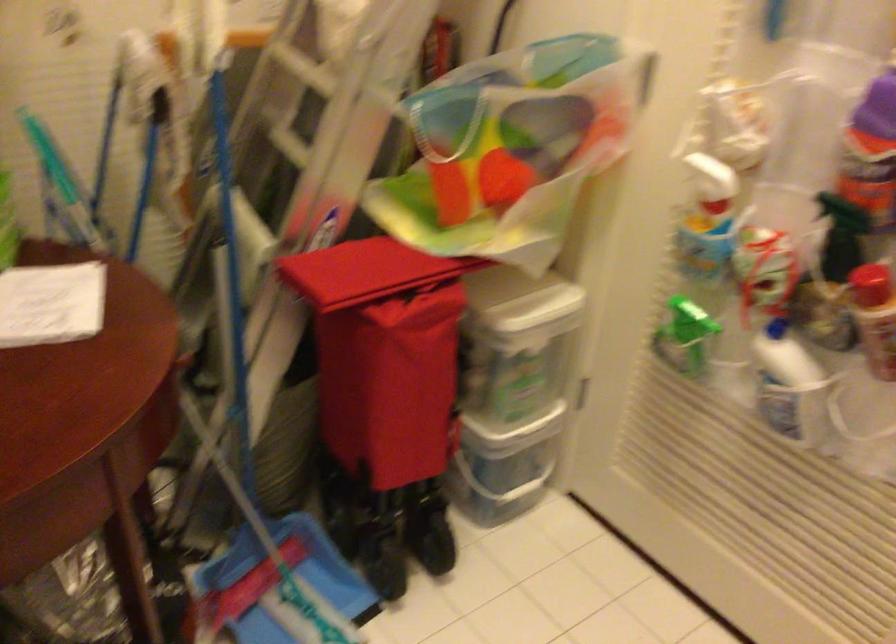
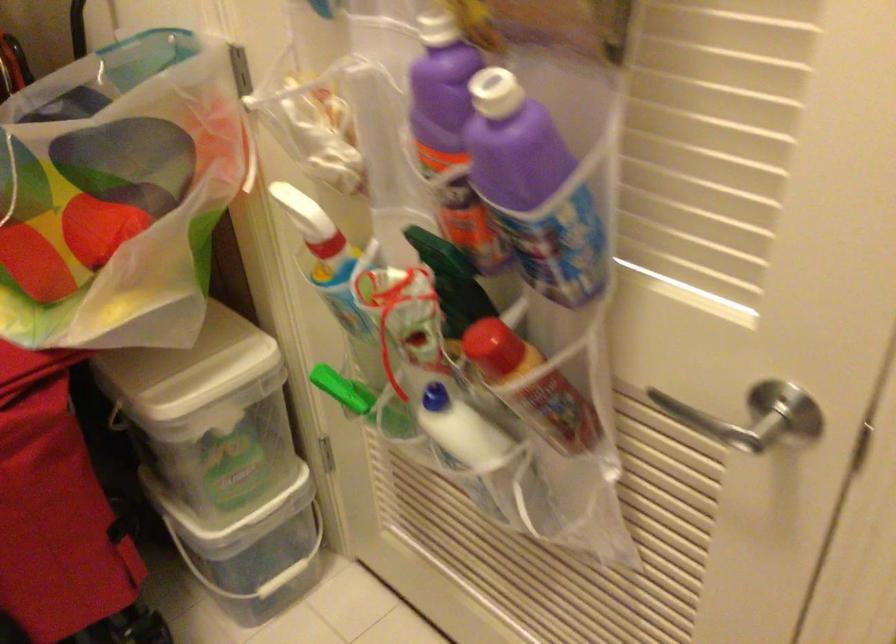
Question: The first image is from the beginning of the video and the second image is from the end. How did the camera likely rotate when shooting the video?

Choices:
 (A) Left
 (B) Right
 (C) Up
 (D) Down

Answer: (D)